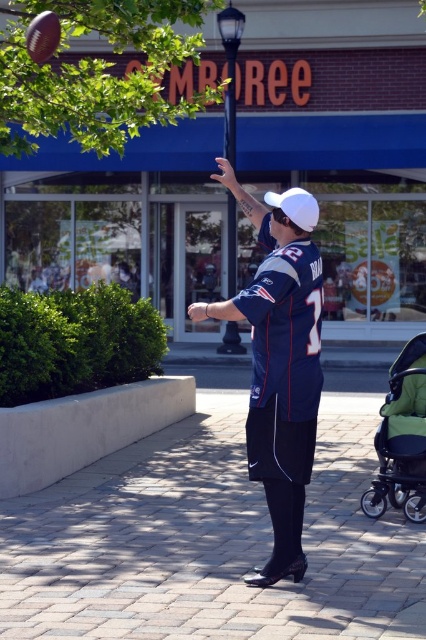
From the picture: Can you confirm if green fabric stroller at lower right is shorter than white matte baseball cap at center?

In fact, green fabric stroller at lower right may be taller than white matte baseball cap at center.

Which is in front, point (382, 451) or point (311, 196)?

Positioned in front is point (311, 196).

Locate an element on the screen. The width and height of the screenshot is (426, 640). green fabric stroller at lower right is located at coordinates (402, 438).

From the picture: Who is higher up, blue jersey at center or white matte baseball cap at center?

Positioned higher is white matte baseball cap at center.

Which of these two, blue jersey at center or white matte baseball cap at center, stands shorter?

Standing shorter between the two is white matte baseball cap at center.

Who is more distant from viewer, [301,339] or [307,209]?

The point [307,209] is more distant.

Image resolution: width=426 pixels, height=640 pixels. In order to click on blue jersey at center in this screenshot , I will do `click(284, 381)`.

Does blue jersey at center appear on the left side of green fabric stroller at lower right?

Yes, blue jersey at center is to the left of green fabric stroller at lower right.

Is blue jersey at center above green fabric stroller at lower right?

Yes, blue jersey at center is above green fabric stroller at lower right.

Who is more forward, (273, 497) or (399, 360)?

Point (273, 497) is in front.

You are a GUI agent. You are given a task and a screenshot of the screen. Output one action in this format:
    pyautogui.click(x=<x>, y=<y>)
    Task: Click on the blue jersey at center
    This screenshot has width=426, height=640.
    Given the screenshot: What is the action you would take?
    pyautogui.click(x=284, y=381)